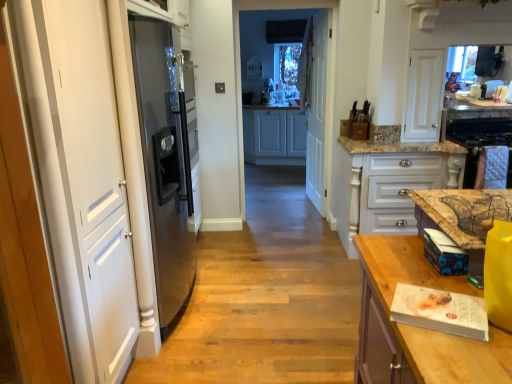
Question: In the image, is white wooden door at center on the left side or the right side of white glossy cabinet at center, which appears as the second cabinetry when viewed from the left?

Choices:
 (A) right
 (B) left

Answer: (B)

Question: From the image's perspective, is white wooden door at center above or below white glossy cabinet at center, the first cabinetry positioned from the right?

Choices:
 (A) above
 (B) below

Answer: (A)

Question: Which is nearer to the wooden table at right, which is the 1th countertop in bottom-to-top order?

Choices:
 (A) white wooden door at center
 (B) quilted fabric oven at right
 (C) white wood cabinets at center, the first cabinetry in the top-to-bottom sequence
 (D) white glossy cabinet at center, which appears as the second cabinetry when viewed from the left
 (E) brown marble countertop at right, which is the 2th countertop in bottom-to-top order

Answer: (E)

Question: Which object is the farthest from the wooden table at right, the second countertop from the top?

Choices:
 (A) brown marble countertop at right, which is the 2th countertop in bottom-to-top order
 (B) white wooden door at center
 (C) white wood cabinets at center, which appears as the second cabinetry when viewed from the right
 (D) quilted fabric oven at right
 (E) white glossy cabinet at center, the 2th cabinetry positioned from the top

Answer: (C)